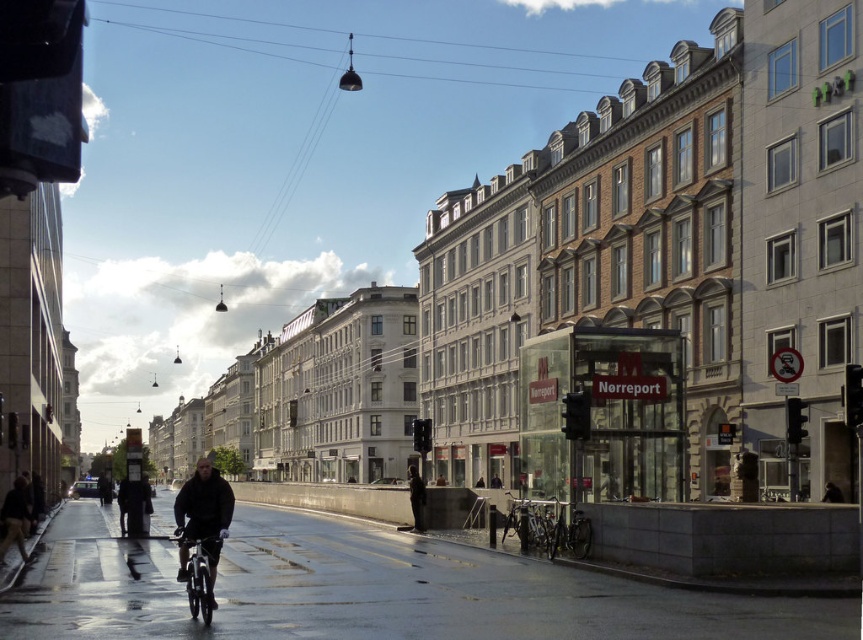
Is dark matte jacket at lower left below metallic silver bicycle at lower center?

Correct, dark matte jacket at lower left is located below metallic silver bicycle at lower center.

Looking at this image, between dark matte jacket at lower left and metallic silver bicycle at lower center, which one is positioned lower?

dark matte jacket at lower left is below.

Find the location of a particular element. Image resolution: width=863 pixels, height=640 pixels. dark matte jacket at lower left is located at coordinates (202, 516).

Can you confirm if silver metallic bicycle at lower right is shorter than dark gray jacket at center?

Indeed, silver metallic bicycle at lower right has a lesser height compared to dark gray jacket at center.

Can you confirm if silver metallic bicycle at lower right is taller than dark gray jacket at center?

Incorrect, silver metallic bicycle at lower right's height is not larger of dark gray jacket at center's.

Which is behind, point (530, 529) or point (410, 472)?

Point (410, 472)

You are a GUI agent. You are given a task and a screenshot of the screen. Output one action in this format:
    pyautogui.click(x=<x>, y=<y>)
    Task: Click on the silver metallic bicycle at lower right
    
    Given the screenshot: What is the action you would take?
    pyautogui.click(x=528, y=522)

Is the position of green matte bicycle at lower center more distant than that of dark gray jacket at center?

No, green matte bicycle at lower center is in front of dark gray jacket at center.

What do you see at coordinates (567, 532) in the screenshot? This screenshot has width=863, height=640. I see `green matte bicycle at lower center` at bounding box center [567, 532].

Between point (565, 536) and point (413, 522), which one is positioned behind?

Point (413, 522)

Locate an element on the screen. This screenshot has width=863, height=640. green matte bicycle at lower center is located at coordinates (567, 532).